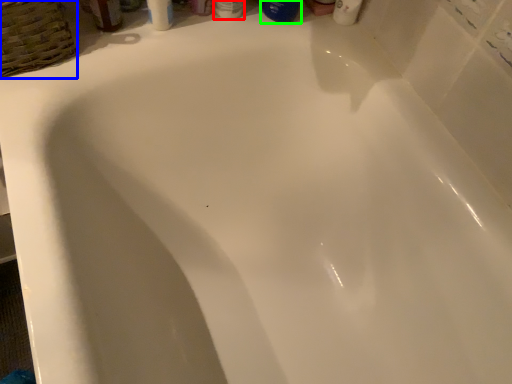
Question: Which object is positioned farthest from toiletry (highlighted by a red box)? Select from basket (highlighted by a blue box) and mouthwash (highlighted by a green box).

Choices:
 (A) basket
 (B) mouthwash

Answer: (A)